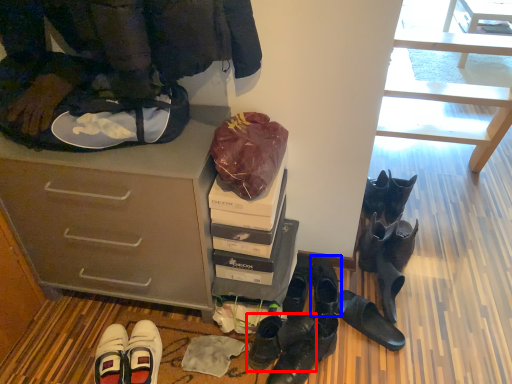
Question: Which object is closer to the camera taking this photo, footwear (highlighted by a red box) or footwear (highlighted by a blue box)?

Choices:
 (A) footwear
 (B) footwear

Answer: (A)